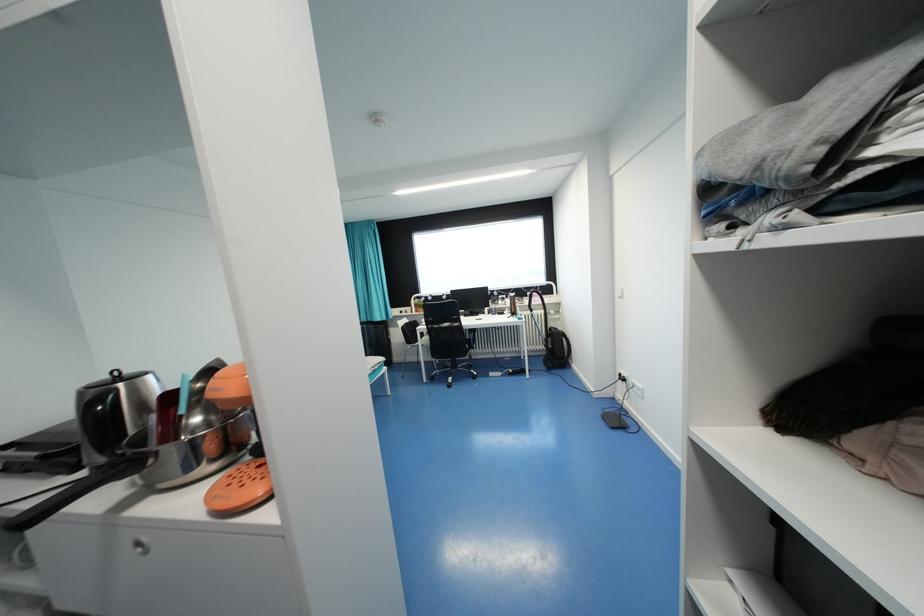
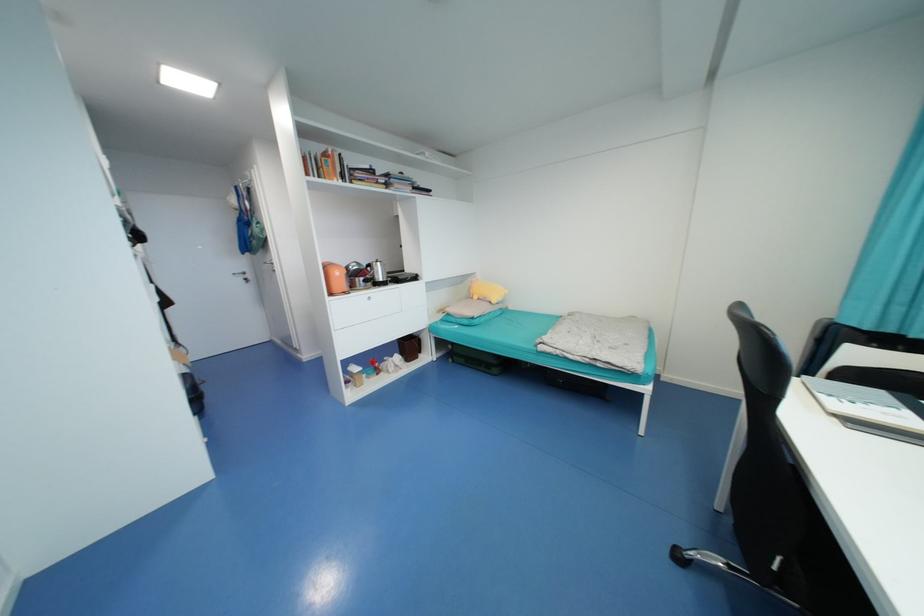
Question: I am providing you with two images of the same scene from different viewpoints. Please identify which objects are invisible in image2.

Choices:
 (A) stainless steel bowl
 (B) orange kettle
 (C) white box lid
 (D) book

Answer: (A)